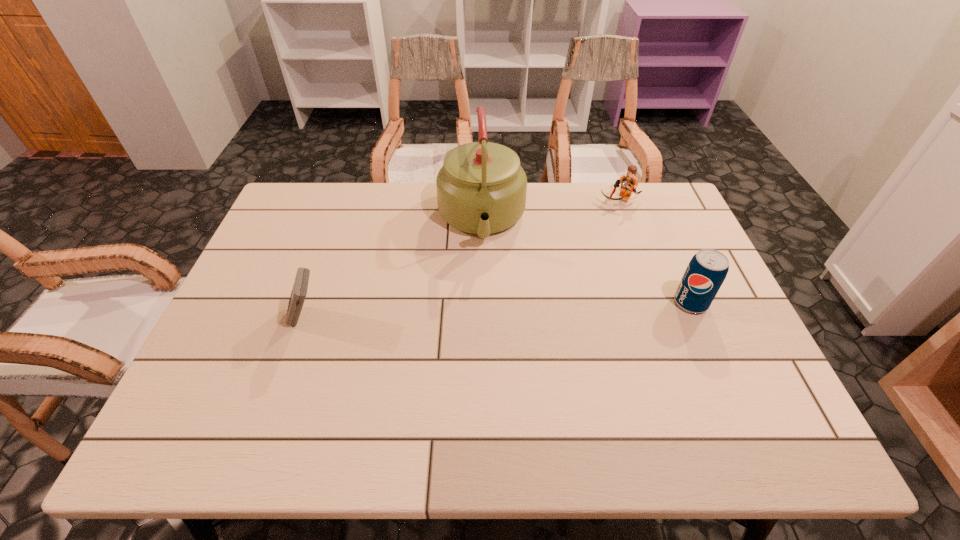
Locate an element on the screen. The width and height of the screenshot is (960, 540). vacant space on the desktop that is between the calculator and the pop and is positioned at the spout of the kettle is located at coordinates (488, 311).

You are a GUI agent. You are given a task and a screenshot of the screen. Output one action in this format:
    pyautogui.click(x=<x>, y=<y>)
    Task: Click on the vacant spot on the desktop that is between the leftmost object and the pop and is positioned holding a crossbow in the hands of the Lego
    The image size is (960, 540).
    Given the screenshot: What is the action you would take?
    pyautogui.click(x=538, y=309)